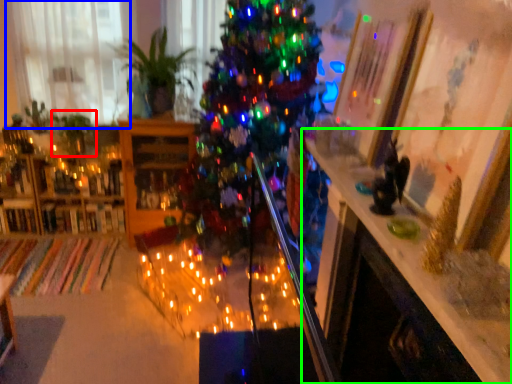
Question: Estimate the real-world distances between objects in this image. Which object is farther from plant (highlighted by a red box), window (highlighted by a blue box) or table (highlighted by a green box)?

Choices:
 (A) window
 (B) table

Answer: (B)